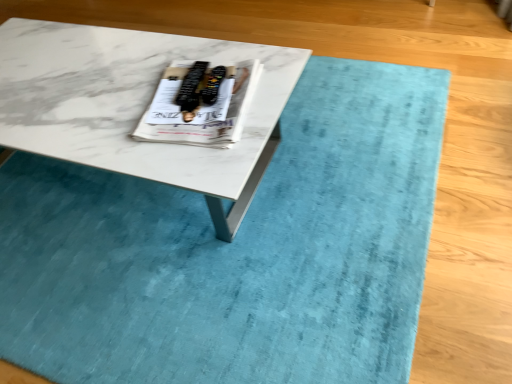
Where is `free space to the back side of white glossy magazine at center`? free space to the back side of white glossy magazine at center is located at coordinates (166, 56).